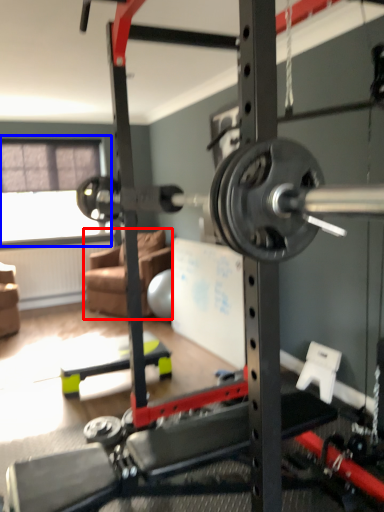
Question: Which of the following is the farthest to the observer, couch (highlighted by a red box) or window screen (highlighted by a blue box)?

Choices:
 (A) couch
 (B) window screen

Answer: (B)